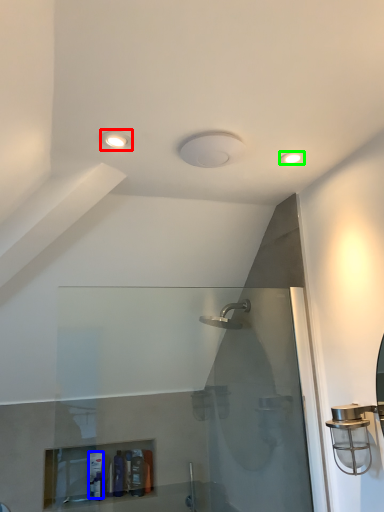
Question: Which is nearer to the light fixture (highlighted by a red box)? toiletry (highlighted by a blue box) or light fixture (highlighted by a green box).

Choices:
 (A) toiletry
 (B) light fixture

Answer: (B)